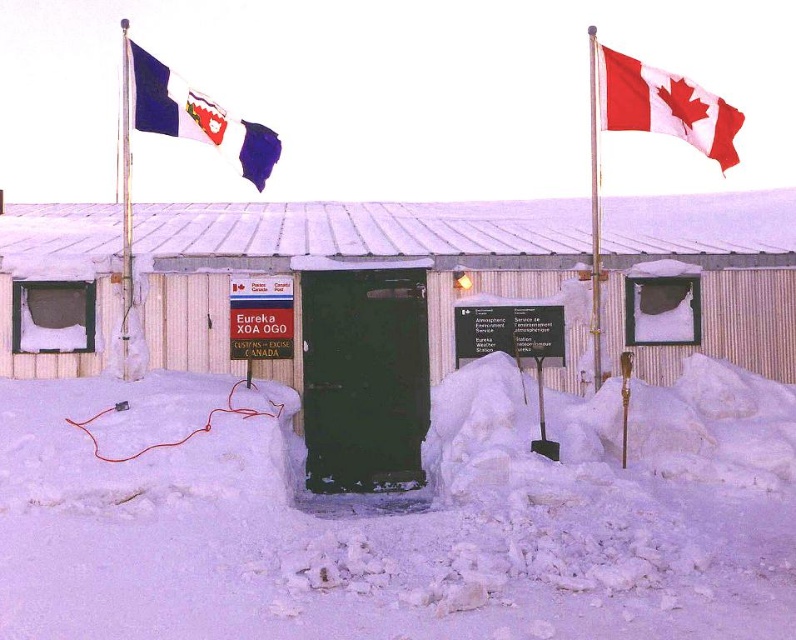
Question: Which of the following is the closest to the observer?

Choices:
 (A) green corrugated metal hut at center
 (B) polished silver flag pole at right

Answer: (A)

Question: Estimate the real-world distances between objects in this image. Which object is closer to the white fabric flag at upper right?

Choices:
 (A) blue fabric flag at upper left
 (B) white fluffy snow at center

Answer: (B)

Question: Estimate the real-world distances between objects in this image. Which object is closer to the white fabric flag at upper right?

Choices:
 (A) metallic silver flag pole at left
 (B) white fluffy snow at center
 (C) polished silver flag pole at right
 (D) blue fabric flag at upper left

Answer: (B)

Question: Is polished silver flag pole at right below metallic silver flag pole at left?

Choices:
 (A) yes
 (B) no

Answer: (A)

Question: Is white fluffy snow at center thinner than metallic silver flag pole at left?

Choices:
 (A) no
 (B) yes

Answer: (A)

Question: Does white fluffy snow at center appear over blue fabric flag at upper left?

Choices:
 (A) yes
 (B) no

Answer: (B)